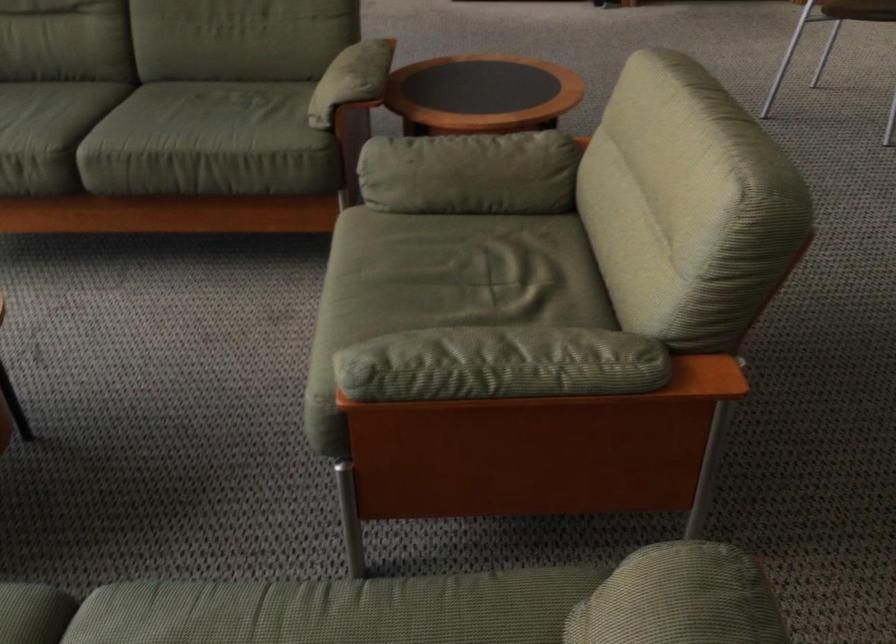
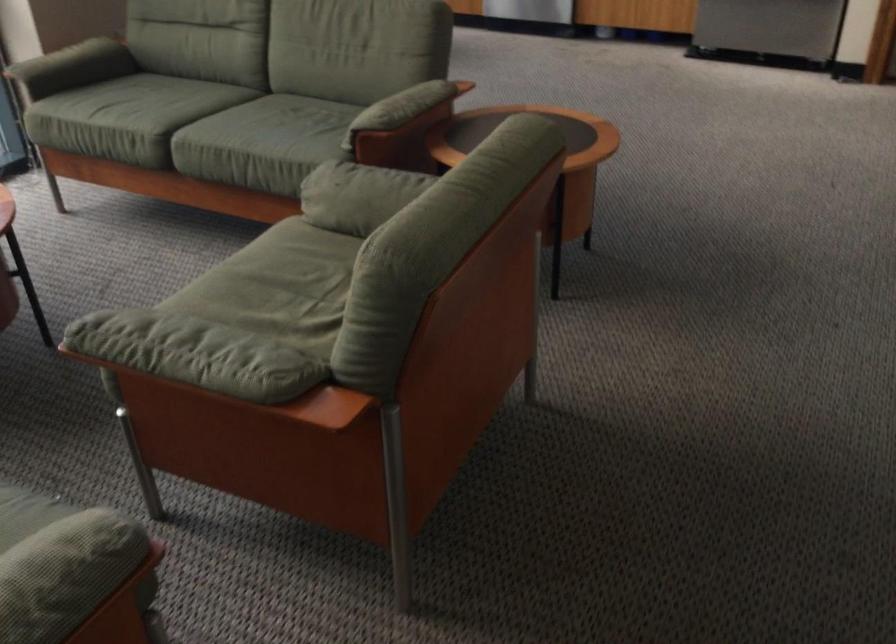
Locate, in the second image, the point that corresponds to point (533, 365) in the first image.

(195, 354)